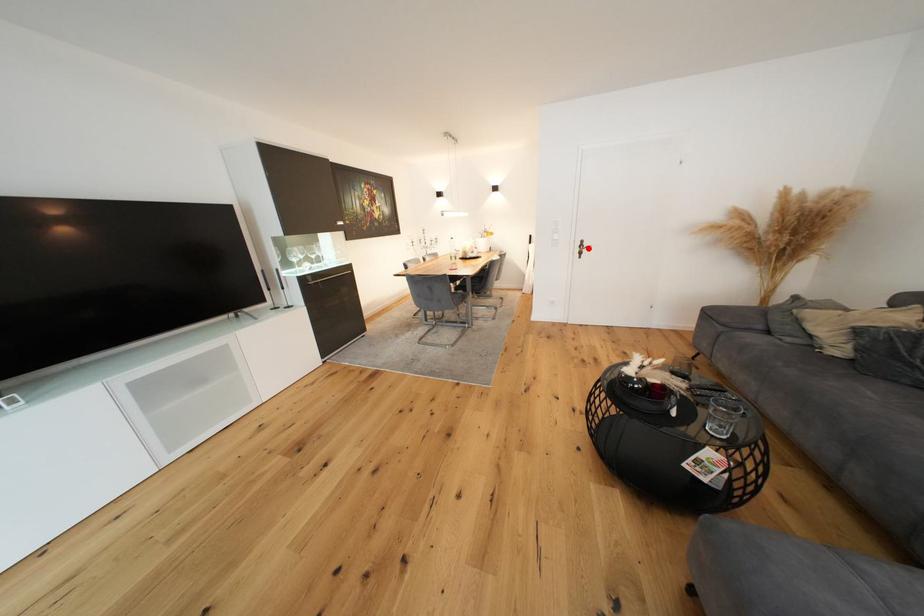
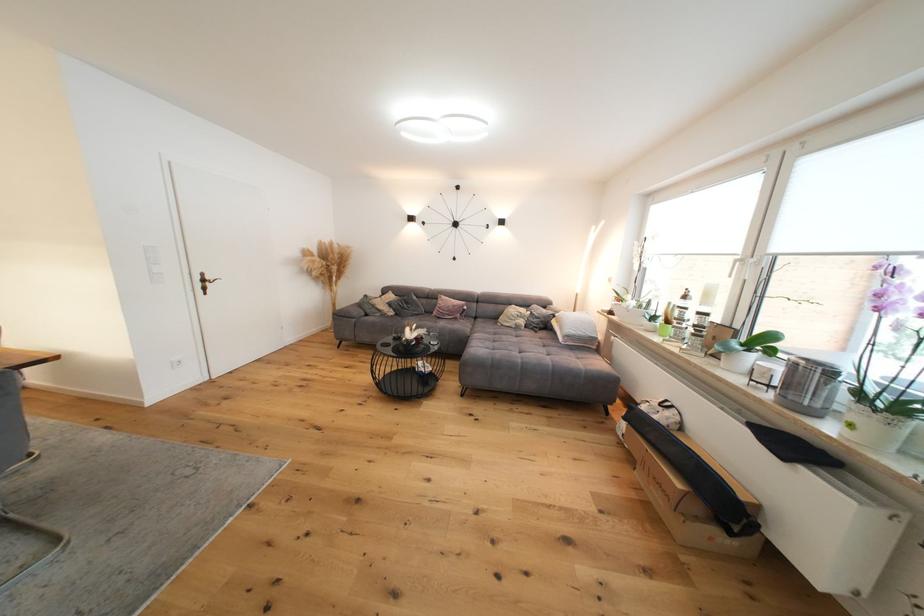
The point at the highlighted location is marked in the first image. Where is the corresponding point in the second image?

(211, 282)